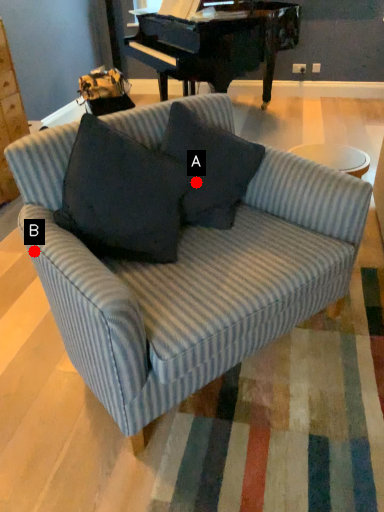
Question: Two points are circled on the image, labeled by A and B beside each circle. Which point is closer to the camera?

Choices:
 (A) A is closer
 (B) B is closer

Answer: (B)